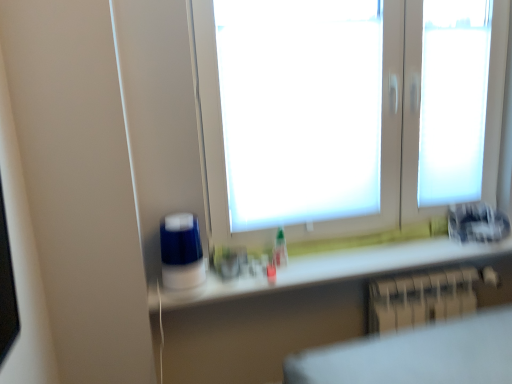
Question: Based on their sizes in the image, would you say white glossy counter top at lower center is bigger or smaller than white matte window at center?

Choices:
 (A) small
 (B) big

Answer: (A)

Question: Relative to white matte window at center, is white glossy counter top at lower center in front or behind?

Choices:
 (A) front
 (B) behind

Answer: (B)

Question: Which of these objects is positioned farthest from the white matte window at center?

Choices:
 (A) metallic silver radiator at lower right
 (B) white glossy counter top at lower center

Answer: (A)

Question: Which object is positioned closest to the white glossy counter top at lower center?

Choices:
 (A) metallic silver radiator at lower right
 (B) white matte window at center

Answer: (A)